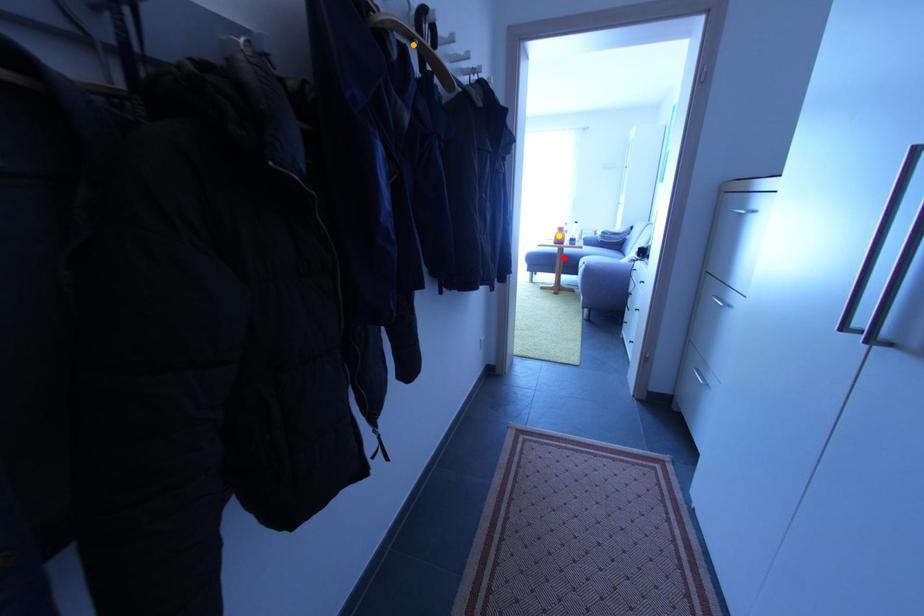
Order these from nearest to farthest:
1. orange point
2. red point
3. yellow point

1. orange point
2. yellow point
3. red point